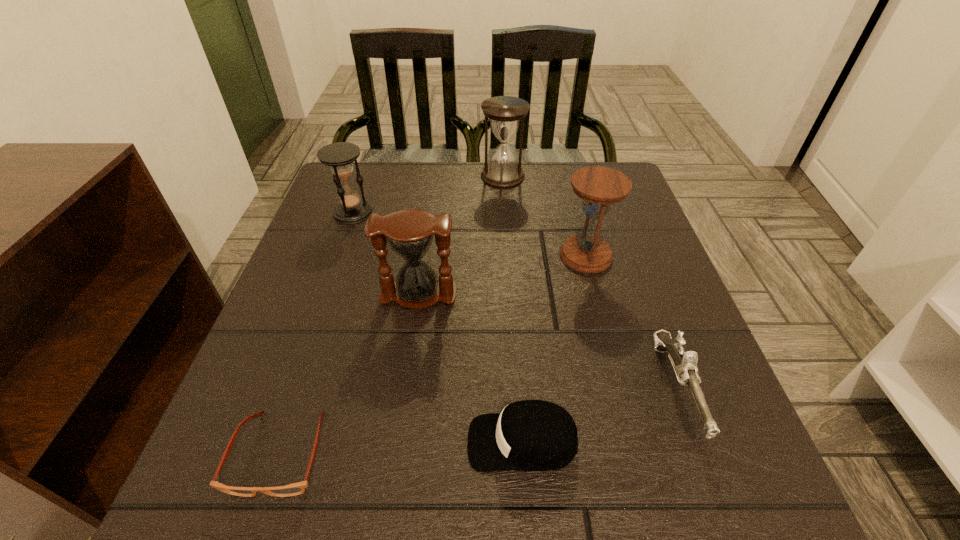
I want to click on vacant space at the left edge, so click(x=264, y=336).

In the image, there is a desktop. What are the coordinates of `free space at the right edge` in the screenshot? It's located at (653, 281).

The width and height of the screenshot is (960, 540). In the image, there is a desktop. Identify the location of vacant space at the far left corner. (386, 200).

This screenshot has height=540, width=960. In the image, there is a desktop. Find the location of `vacant space at the near left corner`. vacant space at the near left corner is located at coordinates (205, 511).

The image size is (960, 540). I want to click on vacant region at the far right corner of the desktop, so click(x=617, y=163).

Find the location of a particular element. vacant region at the near right corner is located at coordinates (695, 519).

Locate an element on the screen. Image resolution: width=960 pixels, height=540 pixels. free space that is in between the shortest object and the rightmost hourglass is located at coordinates (433, 354).

You are a GUI agent. You are given a task and a screenshot of the screen. Output one action in this format:
    pyautogui.click(x=<x>, y=<y>)
    Task: Click on the vacant area that lies between the sixth nearest object and the fifth nearest object
    
    Given the screenshot: What is the action you would take?
    pyautogui.click(x=469, y=234)

I want to click on free spot between the second shortest object and the sixth object from left to right, so click(554, 349).

In order to click on vacant space that's between the third shortest object and the second shortest object in this screenshot , I will do `click(599, 416)`.